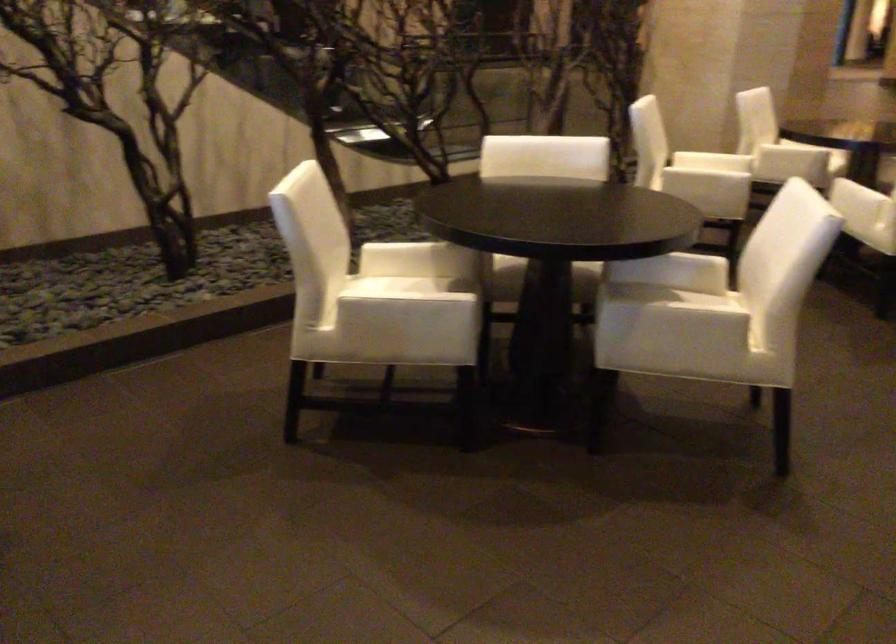
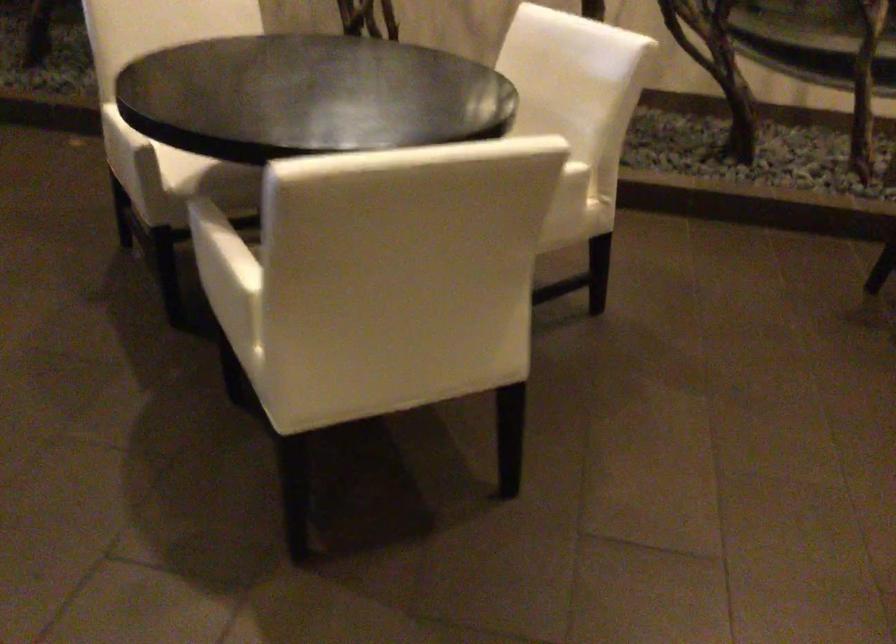
Find the pixel in the second image that matches pixel 686 305 in the first image.

(220, 249)